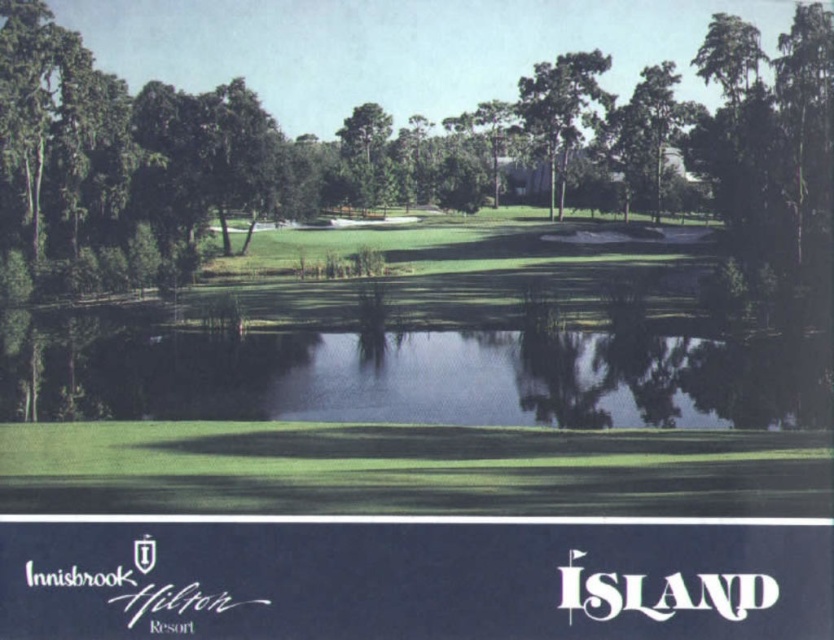
Question: Is green leafy tree at center wider than green leafy tree at upper center?

Choices:
 (A) no
 (B) yes

Answer: (B)

Question: Does green leafy tree at center have a larger size compared to green leafy tree at upper center?

Choices:
 (A) no
 (B) yes

Answer: (B)

Question: Which point is closer to the camera?

Choices:
 (A) (58, 128)
 (B) (564, 132)

Answer: (A)

Question: Where is green leafy tree at center located in relation to green leafy tree at upper center in the image?

Choices:
 (A) below
 (B) above

Answer: (A)

Question: Which object appears farthest from the camera in this image?

Choices:
 (A) green leafy tree at upper center
 (B) green leafy tree at center

Answer: (A)

Question: Which point is closer to the camera?

Choices:
 (A) green leafy tree at center
 (B) green leafy tree at upper center

Answer: (A)